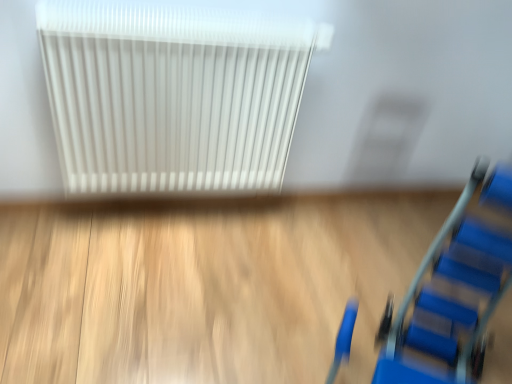
Describe the element at coordinates (452, 292) in the screenshot. This screenshot has width=512, height=384. I see `blue plastic ladder at lower right` at that location.

In order to face blue plastic ladder at lower right, should I rotate leftwards or rightwards?

Turn right approximately 26.275 degrees to face it.

Find the location of `blue plastic ladder at lower right`. blue plastic ladder at lower right is located at coordinates (452, 292).

Describe the element at coordinates (172, 95) in the screenshot. I see `white plastic radiator at upper center` at that location.

Image resolution: width=512 pixels, height=384 pixels. What are the coordinates of `white plastic radiator at upper center` in the screenshot? It's located at (172, 95).

What are the coordinates of `blue plastic ladder at lower right` in the screenshot? It's located at (452, 292).

Considering the positions of objects white plastic radiator at upper center and blue plastic ladder at lower right in the image provided, who is more to the left, white plastic radiator at upper center or blue plastic ladder at lower right?

Positioned to the left is white plastic radiator at upper center.

Considering the relative positions of white plastic radiator at upper center and blue plastic ladder at lower right in the image provided, is white plastic radiator at upper center behind blue plastic ladder at lower right?

Yes, it is behind blue plastic ladder at lower right.

Considering the points (236, 185) and (487, 274), which point is behind, point (236, 185) or point (487, 274)?

The point (236, 185) is farther.

From the image's perspective, is white plastic radiator at upper center beneath blue plastic ladder at lower right?

No.

From a real-world perspective, between white plastic radiator at upper center and blue plastic ladder at lower right, who is vertically higher?

white plastic radiator at upper center, from a real-world perspective.

Which object is wider, white plastic radiator at upper center or blue plastic ladder at lower right?

blue plastic ladder at lower right.

Does white plastic radiator at upper center have a lesser height compared to blue plastic ladder at lower right?

Yes.

Which of these two, white plastic radiator at upper center or blue plastic ladder at lower right, is bigger?

Bigger between the two is blue plastic ladder at lower right.

Is blue plastic ladder at lower right inside white plastic radiator at upper center?

Definitely not — blue plastic ladder at lower right is not inside white plastic radiator at upper center.

Are white plastic radiator at upper center and blue plastic ladder at lower right far apart?

They are positioned close to each other.

Is white plastic radiator at upper center facing towards blue plastic ladder at lower right?

Yes, white plastic radiator at upper center is facing blue plastic ladder at lower right.

How far apart are white plastic radiator at upper center and blue plastic ladder at lower right?

31.75 inches.

The height and width of the screenshot is (384, 512). I want to click on radiator that is behind the blue plastic ladder at lower right, so click(172, 95).

Considering the positions of objects blue plastic ladder at lower right and white plastic radiator at upper center in the image provided, who is more to the right, blue plastic ladder at lower right or white plastic radiator at upper center?

blue plastic ladder at lower right.

Which object is closer to the camera taking this photo, blue plastic ladder at lower right or white plastic radiator at upper center?

blue plastic ladder at lower right is in front.

Between point (466, 301) and point (279, 163), which one is positioned in front?

Positioned in front is point (466, 301).

From the image's perspective, which one is positioned lower, blue plastic ladder at lower right or white plastic radiator at upper center?

blue plastic ladder at lower right.

From a real-world perspective, which is physically below, blue plastic ladder at lower right or white plastic radiator at upper center?

blue plastic ladder at lower right.

Is blue plastic ladder at lower right wider or thinner than white plastic radiator at upper center?

blue plastic ladder at lower right is wider than white plastic radiator at upper center.

Which of these two, blue plastic ladder at lower right or white plastic radiator at upper center, stands taller?

blue plastic ladder at lower right is taller.

Who is bigger, blue plastic ladder at lower right or white plastic radiator at upper center?

Bigger between the two is blue plastic ladder at lower right.

Is blue plastic ladder at lower right inside the boundaries of white plastic radiator at upper center, or outside?

blue plastic ladder at lower right lies outside white plastic radiator at upper center.

Is blue plastic ladder at lower right positioned far away from white plastic radiator at upper center?

blue plastic ladder at lower right is near white plastic radiator at upper center, not far away.

Is blue plastic ladder at lower right facing towards white plastic radiator at upper center?

No, blue plastic ladder at lower right is not aimed at white plastic radiator at upper center.

Measure the distance between blue plastic ladder at lower right and white plastic radiator at upper center.

blue plastic ladder at lower right is 31.75 inches from white plastic radiator at upper center.

This screenshot has width=512, height=384. Identify the location of furniture on the right of white plastic radiator at upper center. (452, 292).

Where is `radiator above the blue plastic ladder at lower right (from the image's perspective)`? This screenshot has height=384, width=512. radiator above the blue plastic ladder at lower right (from the image's perspective) is located at coordinates (172, 95).

Locate an element on the screen. furniture on the right of white plastic radiator at upper center is located at coordinates pos(452,292).